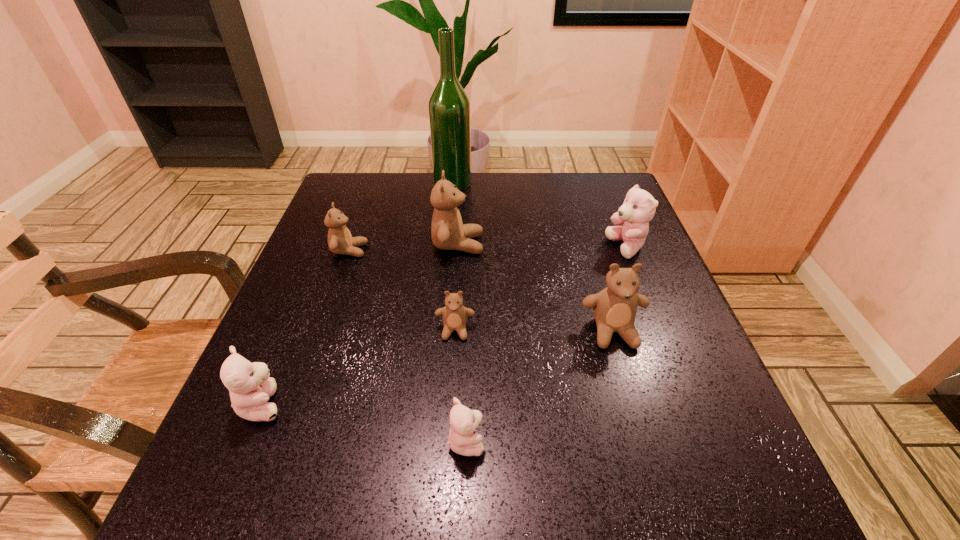
Choose which teddy bear is the nearest neighbor to the second pink teddy bear from right to left. Please provide its 2D coordinates. Your answer should be formatted as a tuple, i.e. [(x, y)], where the tuple contains the x and y coordinates of a point satisfying the conditions above.

[(454, 314)]

You are a GUI agent. You are given a task and a screenshot of the screen. Output one action in this format:
    pyautogui.click(x=<x>, y=<y>)
    Task: Click on the second closest teddy bear to the rightmost brown teddy bear
    
    Given the screenshot: What is the action you would take?
    pyautogui.click(x=454, y=314)

Locate an element on the screen. the second closest brown teddy bear to the leftmost pink teddy bear is located at coordinates (340, 241).

Locate an element on the screen. brown teddy bear that is the third closest to the second biggest pink teddy bear is located at coordinates (448, 232).

Choose which pink teddy bear is the third nearest neighbor to the smallest brown teddy bear. Please provide its 2D coordinates. Your answer should be formatted as a tuple, i.e. [(x, y)], where the tuple contains the x and y coordinates of a point satisfying the conditions above.

[(639, 206)]

Select which pink teddy bear appears as the second closest to the leftmost pink teddy bear. Please provide its 2D coordinates. Your answer should be formatted as a tuple, i.e. [(x, y)], where the tuple contains the x and y coordinates of a point satisfying the conditions above.

[(639, 206)]

Image resolution: width=960 pixels, height=540 pixels. Identify the location of free location that satisfies the following two spatial constraints: 1. on the front-facing side of the third smallest brown teddy bear; 2. at the face of the leftmost pink teddy bear. (635, 404).

At what (x,y) coordinates should I click in order to perform the action: click on vacant space that satisfies the following two spatial constraints: 1. on the front-facing side of the smallest brown teddy bear; 2. at the face of the leftmost pink teddy bear. Please return your answer as a coordinate pair (x, y). Looking at the image, I should click on (451, 404).